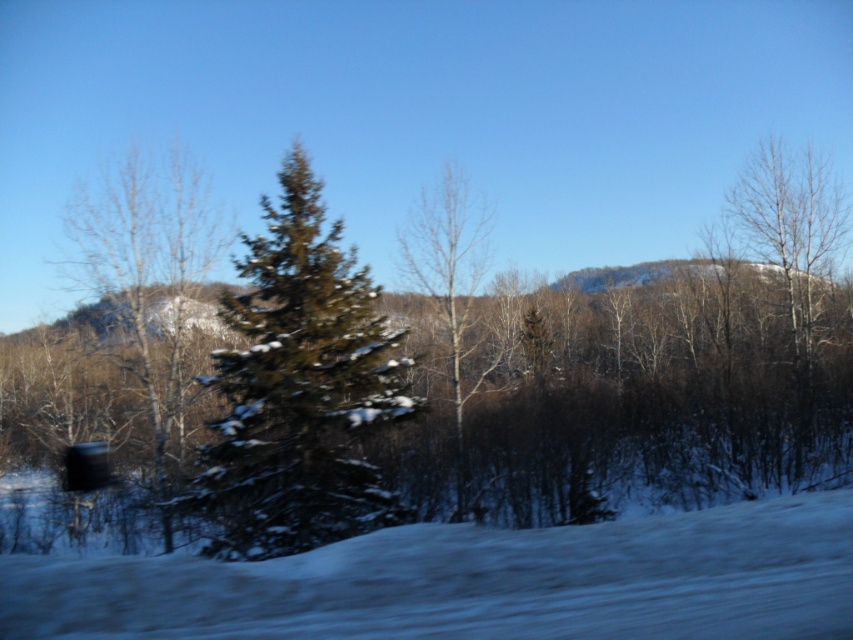
In the scene shown: Is white snow at lower center positioned at the back of bare wood tree at right?

No, white snow at lower center is in front of bare wood tree at right.

Is the position of white snow at lower center less distant than that of bare wood tree at right?

Yes, white snow at lower center is closer to the viewer.

Who is more distant from viewer, (x=750, y=532) or (x=746, y=225)?

The point (x=746, y=225) is more distant.

Where is `white snow at lower center`? white snow at lower center is located at coordinates (474, 582).

Does green matte evergreen at left have a larger size compared to bare wood tree at center?

Actually, green matte evergreen at left might be smaller than bare wood tree at center.

Does green matte evergreen at left appear on the right side of bare wood tree at center?

Incorrect, green matte evergreen at left is not on the right side of bare wood tree at center.

Looking at this image, measure the distance between green matte evergreen at left and camera.

green matte evergreen at left is 55.26 feet away from camera.

Where is `green matte evergreen at left`? The height and width of the screenshot is (640, 853). green matte evergreen at left is located at coordinates (149, 269).

Can you confirm if bare wood tree at right is shorter than bare wood tree at center?

In fact, bare wood tree at right may be taller than bare wood tree at center.

Who is positioned more to the right, bare wood tree at right or bare wood tree at center?

bare wood tree at right is more to the right.

Who is more distant from viewer, (747, 192) or (430, 205)?

The point (747, 192) is more distant.

Where is `bare wood tree at right`? The image size is (853, 640). bare wood tree at right is located at coordinates (793, 230).